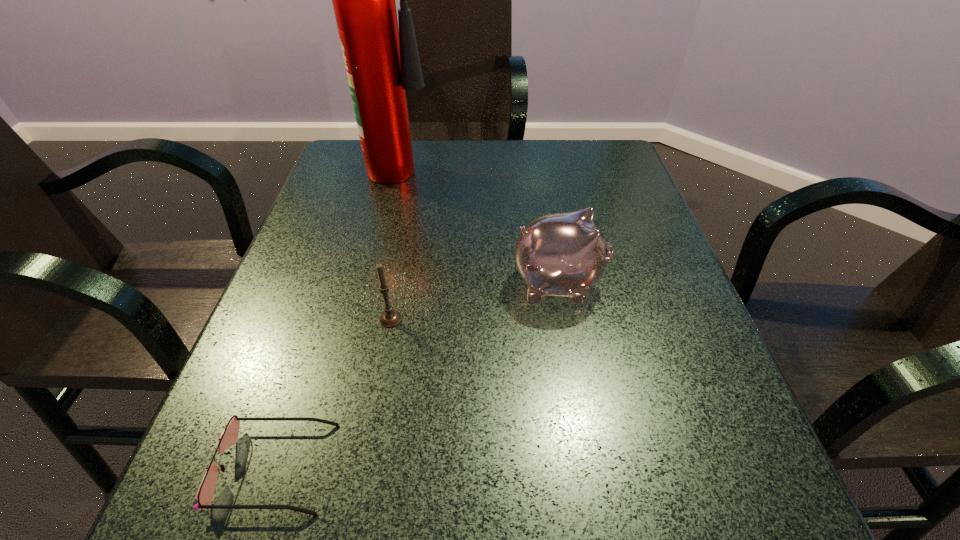
This screenshot has height=540, width=960. In the image, there is a desktop. What are the coordinates of `blank space at the far left corner` in the screenshot? It's located at (361, 165).

Locate an element on the screen. vacant space at the far right corner of the desktop is located at coordinates (589, 163).

In the image, there is a desktop. Where is `free space at the near right corner`? free space at the near right corner is located at coordinates (722, 514).

Locate an element on the screen. The width and height of the screenshot is (960, 540). vacant region between the nearest object and the fire extinguisher is located at coordinates (338, 315).

Identify the location of vacant region between the sunglasses and the rightmost object. The height and width of the screenshot is (540, 960). pos(417,375).

This screenshot has height=540, width=960. I want to click on free space between the shortest object and the rightmost object, so coord(417,375).

Locate an element on the screen. free point between the second shortest object and the shortest object is located at coordinates (333, 393).

You are a GUI agent. You are given a task and a screenshot of the screen. Output one action in this format:
    pyautogui.click(x=<x>, y=<y>)
    Task: Click on the vacant area between the sunglasses and the fire extinguisher
    The width and height of the screenshot is (960, 540).
    Given the screenshot: What is the action you would take?
    pyautogui.click(x=338, y=315)

Locate an element on the screen. vacant space that's between the second shortest object and the fire extinguisher is located at coordinates (396, 241).

I want to click on empty space between the tallest object and the second shortest object, so click(396, 241).